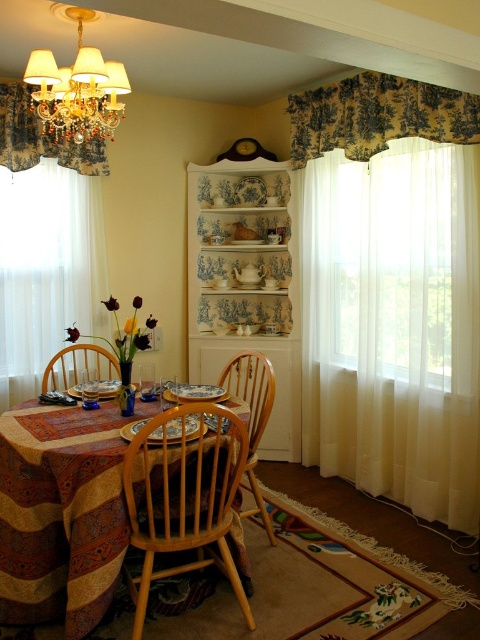
Does gold crystal chandelier at upper center have a lesser height compared to wooden chair at table?

No.

Is gold crystal chandelier at upper center to the right of wooden chair at table from the viewer's perspective?

Indeed, gold crystal chandelier at upper center is positioned on the right side of wooden chair at table.

Identify the location of gold crystal chandelier at upper center. This screenshot has width=480, height=640. (76, 90).

This screenshot has height=640, width=480. What are the coordinates of `gold crystal chandelier at upper center` in the screenshot? It's located at (76, 90).

Measure the distance between striped fabric table at center and wooden chair at table.

striped fabric table at center is 28.33 inches from wooden chair at table.

Does point (91, 529) come closer to viewer compared to point (91, 372)?

Yes, it is in front of point (91, 372).

What are the coordinates of `striped fabric table at center` in the screenshot? It's located at (60, 515).

Can you confirm if striped fabric table at center is shorter than white sheer curtain at left?

Indeed, striped fabric table at center has a lesser height compared to white sheer curtain at left.

Can you confirm if striped fabric table at center is positioned to the right of white sheer curtain at left?

Indeed, striped fabric table at center is positioned on the right side of white sheer curtain at left.

Is point (105, 518) in front of point (94, 163)?

That is True.

This screenshot has height=640, width=480. I want to click on striped fabric table at center, so click(60, 515).